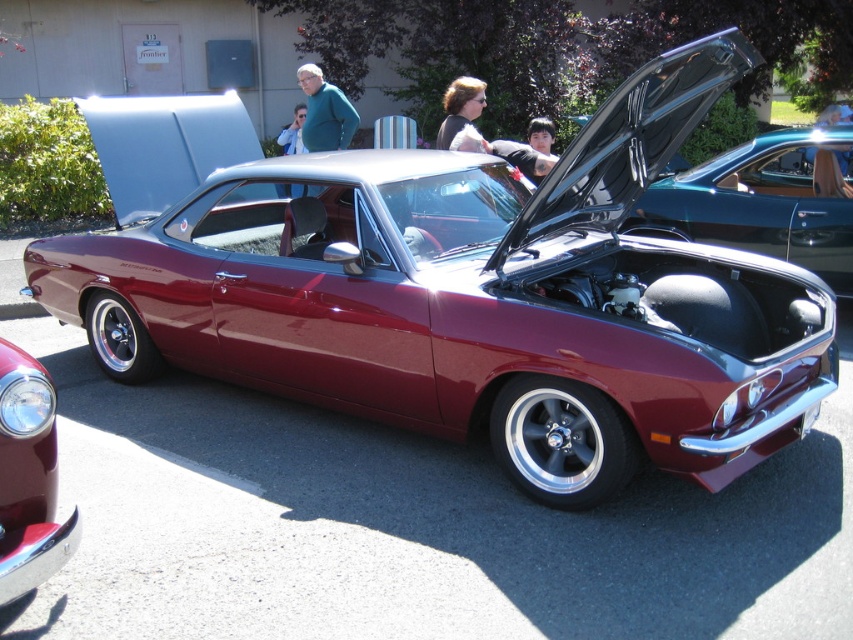
Question: Based on their relative distances, which object is farther from the shiny teal car at center?

Choices:
 (A) dark brown hair at center
 (B) glossy chrome headlight at lower left

Answer: (B)

Question: Does glossy chrome headlight at lower left appear on the left side of dark brown hair at center?

Choices:
 (A) yes
 (B) no

Answer: (A)

Question: Is glossy chrome headlight at lower left to the right of dark brown hair at center from the viewer's perspective?

Choices:
 (A) yes
 (B) no

Answer: (B)

Question: Considering the real-world distances, which object is closest to the glossy chrome headlight at lower left?

Choices:
 (A) dark brown hair at center
 (B) shiny teal car at center

Answer: (A)

Question: Does shiny teal car at center appear on the left side of glossy chrome headlight at lower left?

Choices:
 (A) no
 (B) yes

Answer: (A)

Question: Which of these objects is positioned closest to the shiny teal car at center?

Choices:
 (A) glossy chrome headlight at lower left
 (B) dark brown hair at center

Answer: (B)